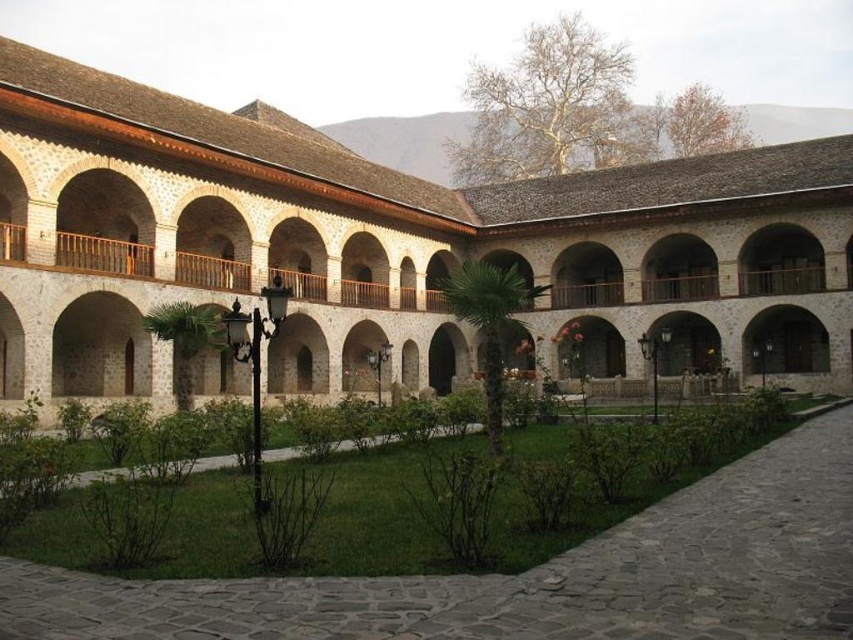
You are planning to install a small garden between the white stone building at center and the green grass at center. Given that the distance between them is 147.77 feet, what is the minimum length of the garden path you need to create to connect both areas?

The minimum length of the garden path needed to connect the white stone building at center and the green grass at center is 147.77 feet, as that is the distance between them.